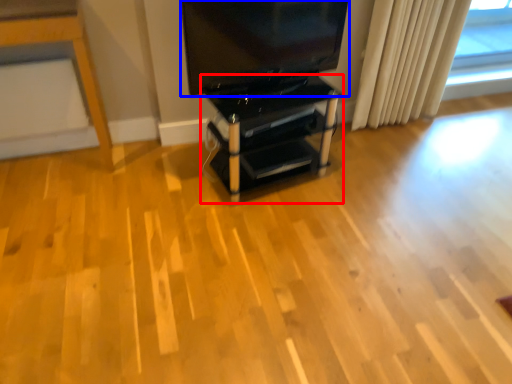
Question: Which object is closer to the camera taking this photo, furniture (highlighted by a red box) or television (highlighted by a blue box)?

Choices:
 (A) furniture
 (B) television

Answer: (B)